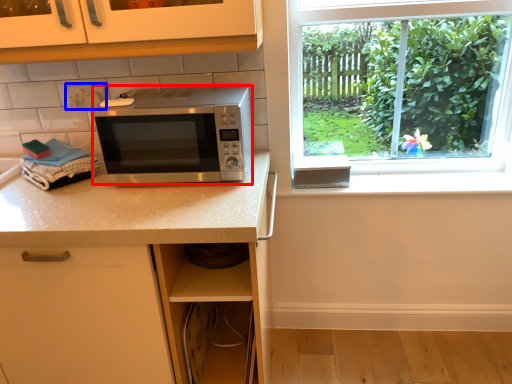
Question: Which point is closer to the camera, microwave oven (highlighted by a red box) or electric outlet (highlighted by a blue box)?

Choices:
 (A) microwave oven
 (B) electric outlet

Answer: (A)